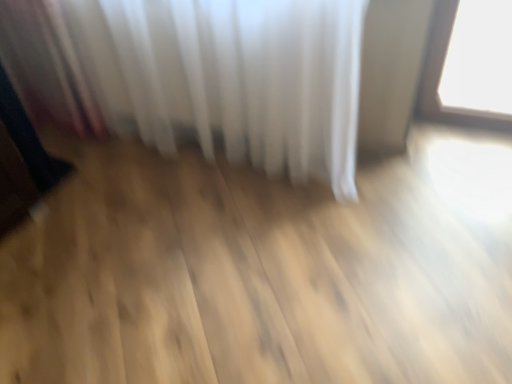
Locate an element on the screen. Image resolution: width=512 pixels, height=384 pixels. white sheer curtain at upper center is located at coordinates (200, 76).

This screenshot has width=512, height=384. What do you see at coordinates (200, 76) in the screenshot?
I see `white sheer curtain at upper center` at bounding box center [200, 76].

Find the location of `metallic reflective object at left`. metallic reflective object at left is located at coordinates (22, 160).

What is the approximate height of metallic reflective object at left?

The height of metallic reflective object at left is 83.85 centimeters.

What is the approximate width of metallic reflective object at left?

metallic reflective object at left is 10.77 inches wide.

What do you see at coordinates (22, 160) in the screenshot? I see `metallic reflective object at left` at bounding box center [22, 160].

This screenshot has width=512, height=384. Find the location of `white sheer curtain at upper center`. white sheer curtain at upper center is located at coordinates (200, 76).

Is metallic reflective object at left to the left or to the right of white sheer curtain at upper center in the image?

Based on their positions, metallic reflective object at left is located to the left of white sheer curtain at upper center.

From the picture: Considering their positions, is metallic reflective object at left located in front of or behind white sheer curtain at upper center?

metallic reflective object at left is positioned farther from the viewer than white sheer curtain at upper center.

Considering the points (34, 198) and (59, 11), which point is behind, point (34, 198) or point (59, 11)?

The point (34, 198) is behind.

From the image's perspective, between metallic reflective object at left and white sheer curtain at upper center, who is located below?

From the image's view, metallic reflective object at left is below.

From a real-world perspective, is metallic reflective object at left above or below white sheer curtain at upper center?

metallic reflective object at left is situated lower than white sheer curtain at upper center in the real world.

Is metallic reflective object at left wider than white sheer curtain at upper center?

No, metallic reflective object at left is not wider than white sheer curtain at upper center.

Does metallic reflective object at left have a greater height compared to white sheer curtain at upper center?

In fact, metallic reflective object at left may be shorter than white sheer curtain at upper center.

Based on their sizes in the image, would you say metallic reflective object at left is bigger or smaller than white sheer curtain at upper center?

metallic reflective object at left is smaller than white sheer curtain at upper center.

Is metallic reflective object at left not inside white sheer curtain at upper center?

Yes.

Is metallic reflective object at left not near white sheer curtain at upper center?

They are positioned close to each other.

Could you tell me if metallic reflective object at left is facing white sheer curtain at upper center?

No, metallic reflective object at left is not aimed at white sheer curtain at upper center.

How different are the orientations of metallic reflective object at left and white sheer curtain at upper center in degrees?

The angular difference between metallic reflective object at left and white sheer curtain at upper center is 82.4 degrees.

I want to click on dark directly beneath the white sheer curtain at upper center (from a real-world perspective), so click(x=22, y=160).

Is white sheer curtain at upper center to the right of metallic reflective object at left from the viewer's perspective?

Yes, white sheer curtain at upper center is to the right of metallic reflective object at left.

Which object is closer to the camera, white sheer curtain at upper center or metallic reflective object at left?

white sheer curtain at upper center is in front.

Does point (349, 182) come in front of point (55, 183)?

Yes, point (349, 182) is in front of point (55, 183).

From the image's perspective, does white sheer curtain at upper center appear lower than metallic reflective object at left?

Incorrect, from the image's perspective, white sheer curtain at upper center is higher than metallic reflective object at left.

From a real-world perspective, who is located higher, white sheer curtain at upper center or metallic reflective object at left?

In real-world perspective, white sheer curtain at upper center is above.

Considering the relative sizes of white sheer curtain at upper center and metallic reflective object at left in the image provided, is white sheer curtain at upper center wider than metallic reflective object at left?

Yes.

Is white sheer curtain at upper center shorter than metallic reflective object at left?

No, white sheer curtain at upper center is not shorter than metallic reflective object at left.

Considering the sizes of objects white sheer curtain at upper center and metallic reflective object at left in the image provided, who is smaller, white sheer curtain at upper center or metallic reflective object at left?

Smaller between the two is metallic reflective object at left.

Can metallic reflective object at left be found inside white sheer curtain at upper center?

That's incorrect, metallic reflective object at left is not inside white sheer curtain at upper center.

Would you consider white sheer curtain at upper center to be distant from metallic reflective object at left?

No, white sheer curtain at upper center is not far from metallic reflective object at left.

Is white sheer curtain at upper center facing towards metallic reflective object at left?

Yes, white sheer curtain at upper center is aimed at metallic reflective object at left.

Can you tell me how much white sheer curtain at upper center and metallic reflective object at left differ in facing direction?

The angle between the facing direction of white sheer curtain at upper center and the facing direction of metallic reflective object at left is 82.4 degrees.

Find the location of a particular element. This screenshot has width=512, height=384. dark that is under the white sheer curtain at upper center (from a real-world perspective) is located at coordinates (22, 160).

I want to click on curtain above the metallic reflective object at left (from a real-world perspective), so click(x=200, y=76).

Image resolution: width=512 pixels, height=384 pixels. I want to click on curtain lying on the right of metallic reflective object at left, so click(x=200, y=76).